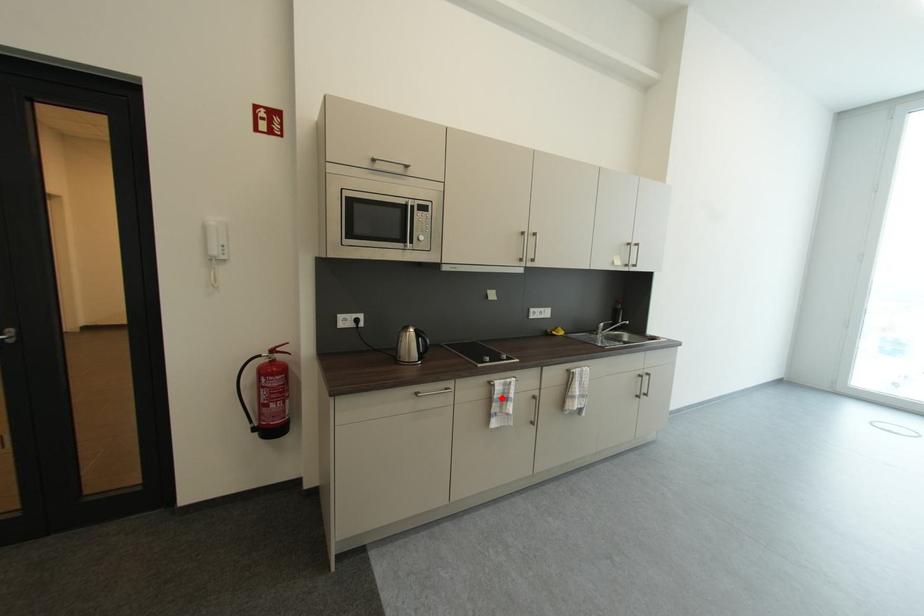
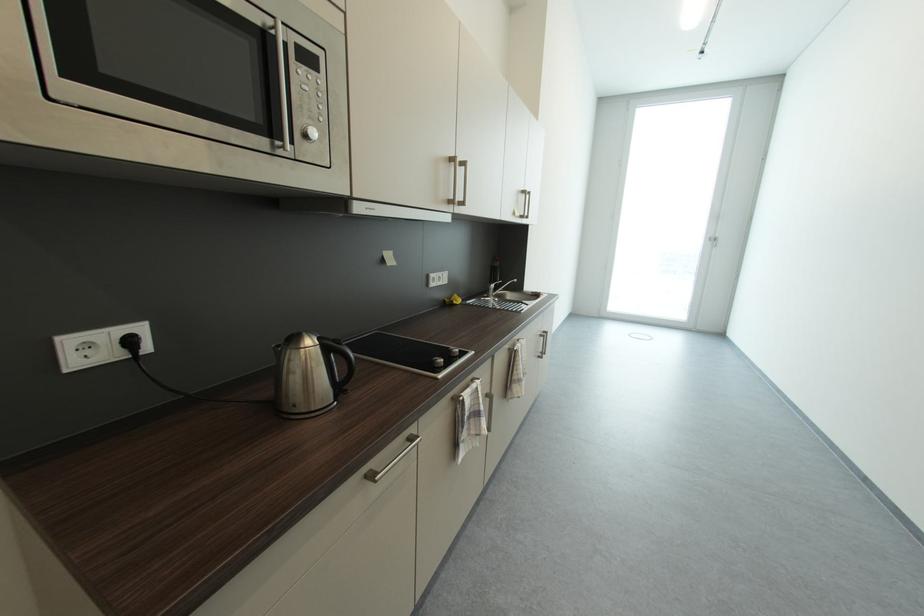
The point at the highlighted location is marked in the first image. Where is the corresponding point in the second image?

(472, 419)